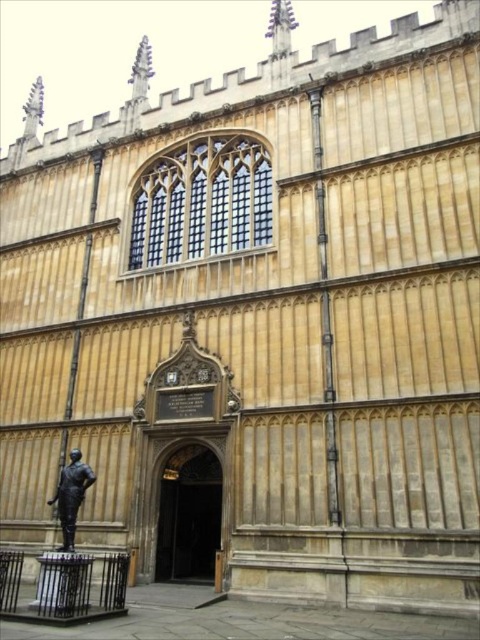
You are a tour guide explaining the layout of the historic building. You mention both the dark brown wooden door at center and the bronze statue at lower left. Which object takes up more space in the image?

The bronze statue at lower left takes up more space in the image because the dark brown wooden door at center occupies less space than bronze statue at lower left.

You are standing in front of the grand Gothic building and want to enter through the dark brown wooden door at center. Based on the coordinates provided, can you confirm if the door is located at point (x=189, y=515)?

Yes, the dark brown wooden door at center is located at point (x=189, y=515) as stated in the coordinates.